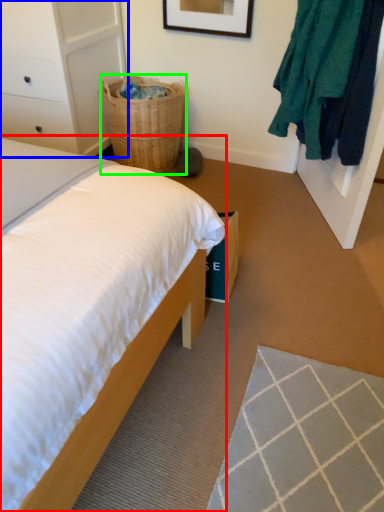
Question: Which object is positioned farthest from bed (highlighted by a red box)? Select from dresser (highlighted by a blue box) and basket (highlighted by a green box).

Choices:
 (A) dresser
 (B) basket

Answer: (B)